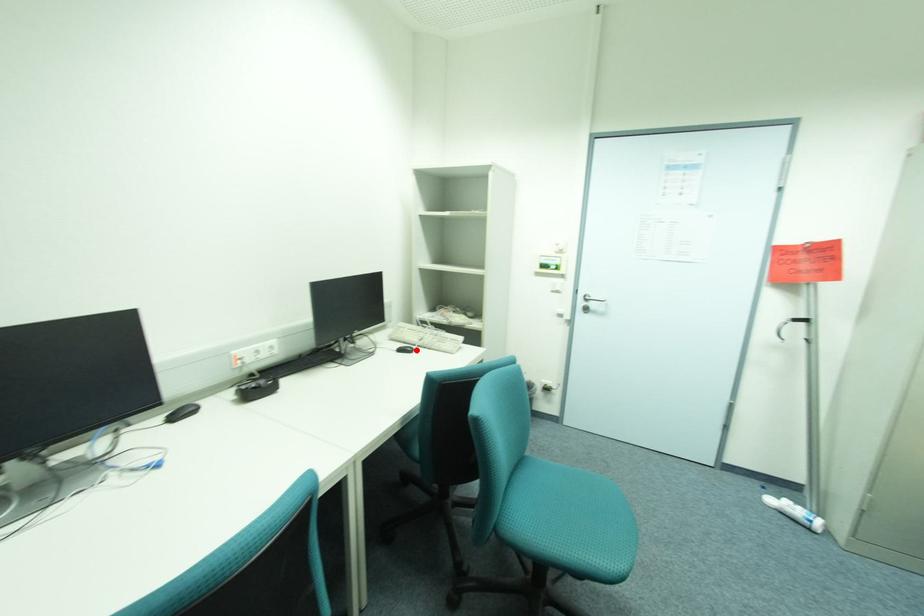
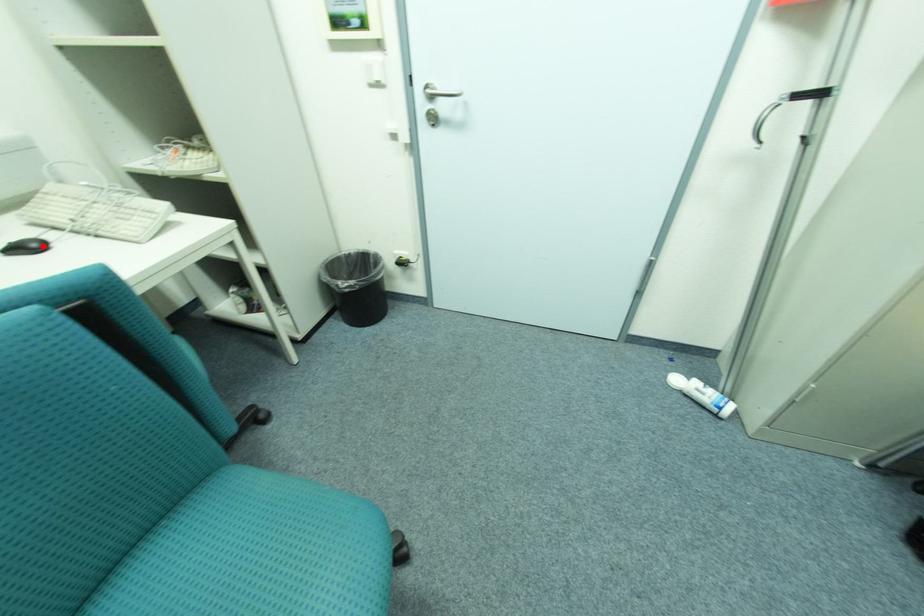
I am providing you with two images of the same scene from different viewpoints. A red point is marked on the first image and another point is marked on the second image. Does the point marked in image1 correspond to the same location as the one in image2?

Yes